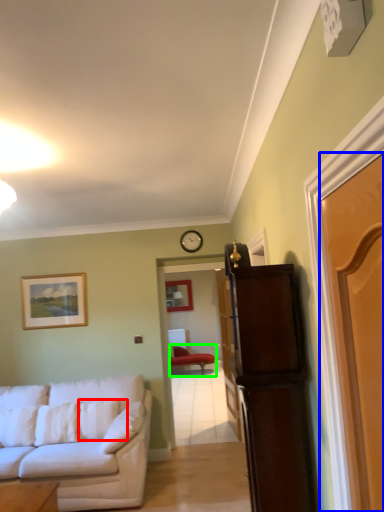
Question: Based on their relative distances, which object is nearer to pillow (highlighted by a red box)? Choose from door (highlighted by a blue box) and chair (highlighted by a green box).

Choices:
 (A) door
 (B) chair

Answer: (A)